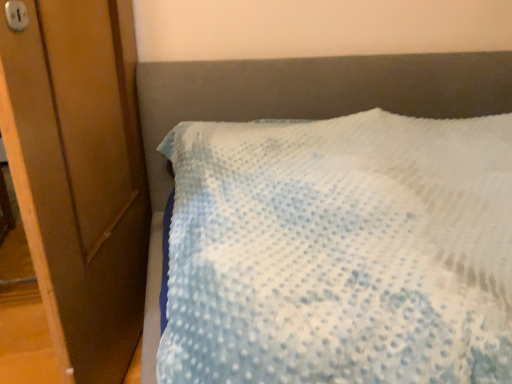
This screenshot has height=384, width=512. Identify the location of wooden door at left. (80, 175).

What do you see at coordinates (80, 175) in the screenshot?
I see `wooden door at left` at bounding box center [80, 175].

Find the location of a particular element. This screenshot has height=384, width=512. wooden door at left is located at coordinates (80, 175).